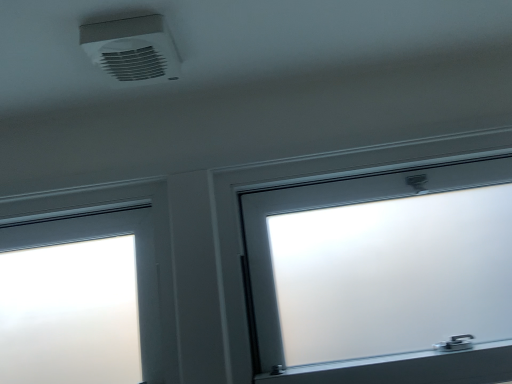
Question: From a real-world perspective, is white plastic air conditioning at upper center beneath frosted glass window at center?

Choices:
 (A) yes
 (B) no

Answer: (B)

Question: Does white plastic air conditioning at upper center have a larger size compared to frosted glass window at center?

Choices:
 (A) yes
 (B) no

Answer: (B)

Question: From the image's perspective, is white plastic air conditioning at upper center on frosted glass window at center?

Choices:
 (A) no
 (B) yes

Answer: (B)

Question: Does white plastic air conditioning at upper center have a greater width compared to frosted glass window at center?

Choices:
 (A) yes
 (B) no

Answer: (B)

Question: From a real-world perspective, is white plastic air conditioning at upper center positioned over frosted glass window at center based on gravity?

Choices:
 (A) yes
 (B) no

Answer: (A)

Question: Is white plastic air conditioning at upper center at the left side of frosted glass window at center?

Choices:
 (A) no
 (B) yes

Answer: (B)

Question: Does frosted glass window at center have a larger size compared to white plastic air conditioning at upper center?

Choices:
 (A) no
 (B) yes

Answer: (B)

Question: Does frosted glass window at center have a smaller size compared to white plastic air conditioning at upper center?

Choices:
 (A) yes
 (B) no

Answer: (B)

Question: Can you confirm if frosted glass window at center is thinner than white plastic air conditioning at upper center?

Choices:
 (A) yes
 (B) no

Answer: (B)

Question: Is frosted glass window at center wider than white plastic air conditioning at upper center?

Choices:
 (A) yes
 (B) no

Answer: (A)

Question: From a real-world perspective, is frosted glass window at center over white plastic air conditioning at upper center?

Choices:
 (A) no
 (B) yes

Answer: (A)

Question: From a real-world perspective, is frosted glass window at center beneath white plastic air conditioning at upper center?

Choices:
 (A) yes
 (B) no

Answer: (A)

Question: Does point (170, 66) appear closer or farther from the camera than point (411, 240)?

Choices:
 (A) farther
 (B) closer

Answer: (B)